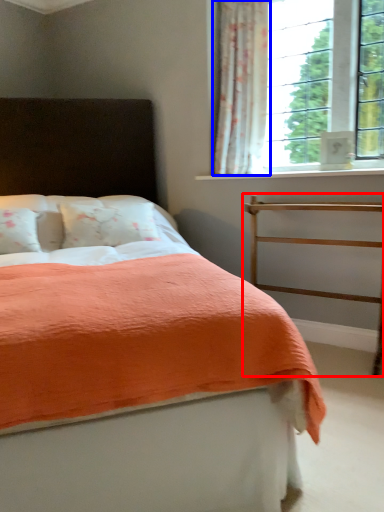
Question: Which point is further to the camera, balustrade (highlighted by a red box) or curtain (highlighted by a blue box)?

Choices:
 (A) balustrade
 (B) curtain

Answer: (B)